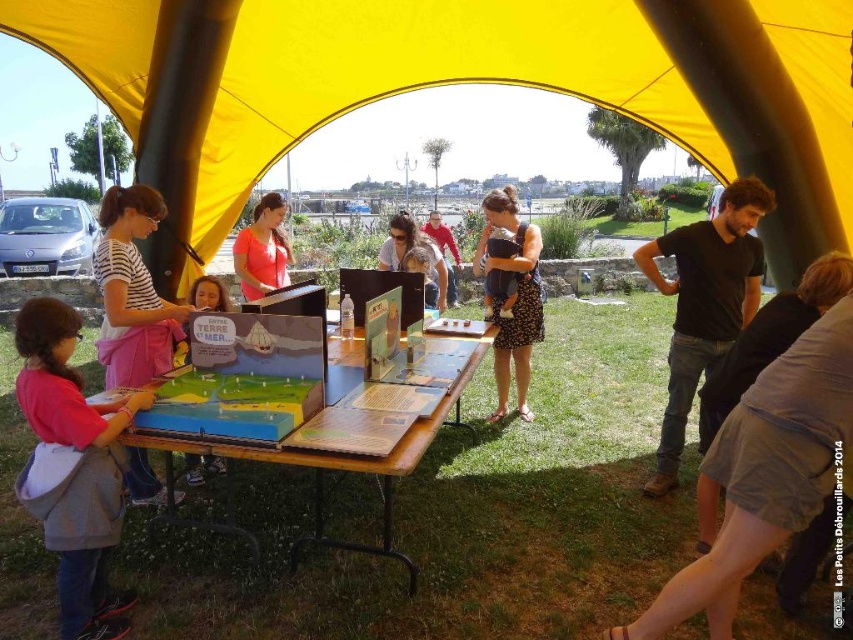
Question: Which point is farther to the camera?

Choices:
 (A) (22, 16)
 (B) (209, 307)

Answer: (A)

Question: Among these objects, which one is farthest from the camera?

Choices:
 (A) dotted fabric dress at center
 (B) striped fabric shirt at center
 (C) black cotton shirt at right

Answer: (A)

Question: Does dotted fabric dress at center have a larger size compared to matte cardboard poster at center?

Choices:
 (A) yes
 (B) no

Answer: (A)

Question: Can you confirm if dotted fabric dress at center is positioned above matte red shirt at center?

Choices:
 (A) no
 (B) yes

Answer: (A)

Question: Is pink fabric shirt at lower left above striped fabric shirt at center?

Choices:
 (A) yes
 (B) no

Answer: (B)

Question: Which of the following is the farthest from the observer?

Choices:
 (A) matte cardboard poster at center
 (B) striped fabric shirt at center

Answer: (A)